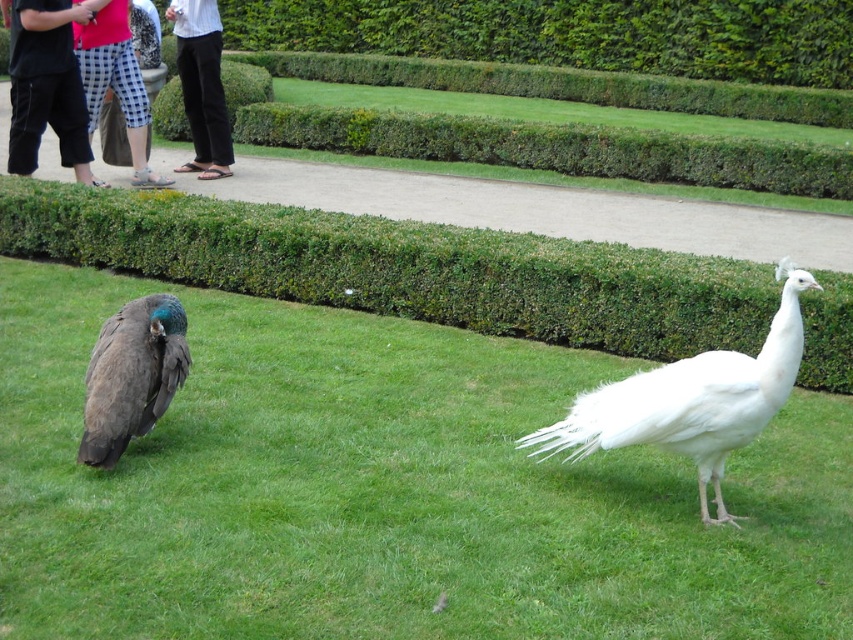
Question: Which is farther from the green grass at center?

Choices:
 (A) checkered fabric pants at left
 (B) black pants at upper left
 (C) black pants at left
 (D) brown feathered peacock at lower left

Answer: (B)

Question: Can you confirm if green grass at center is bigger than brown feathered peacock at lower left?

Choices:
 (A) no
 (B) yes

Answer: (B)

Question: Can you confirm if green leafy hedge at center is smaller than checkered fabric pants at left?

Choices:
 (A) no
 (B) yes

Answer: (A)

Question: Is black pants at left to the right of black pants at upper left from the viewer's perspective?

Choices:
 (A) no
 (B) yes

Answer: (A)

Question: Which object is closer to the camera taking this photo?

Choices:
 (A) green grass at center
 (B) white feathered peacock at center

Answer: (A)

Question: Which object is farther from the camera taking this photo?

Choices:
 (A) white feathered peacock at center
 (B) green grass at center

Answer: (A)